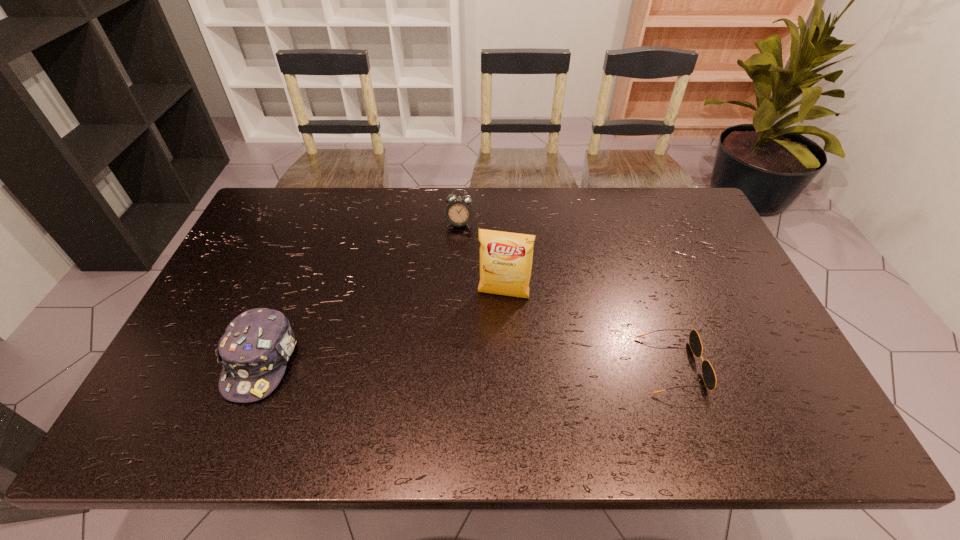
Identify the location of free space on the desktop that is between the leftmost object and the sunglasses and is positioned on the face of the farthest object. The image size is (960, 540). (427, 363).

Identify the location of vacant space on the desktop that is between the leftmost object and the rightmost object and is positioned on the front of the second farthest object with the logo. The height and width of the screenshot is (540, 960). (490, 364).